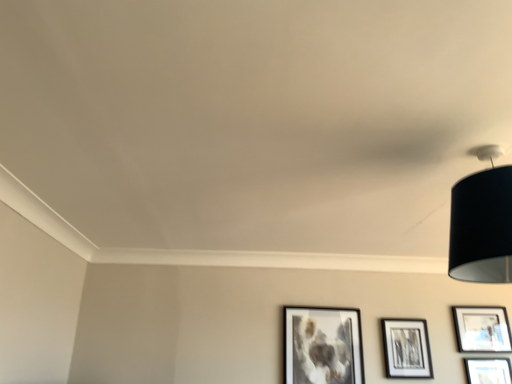
Question: Should I look upward or downward to see matte black picture frame at center right, placed as the 2th picture frame when sorted from left to right?

Choices:
 (A) down
 (B) up

Answer: (A)

Question: Is matte black picture frame at lower right, arranged as the fourth picture frame when viewed from the left, taller than matte black picture frame at lower center, placed as the fourth picture frame when sorted from right to left?

Choices:
 (A) yes
 (B) no

Answer: (B)

Question: From the image's perspective, is matte black picture frame at lower right, which is the 1th picture frame in right-to-left order, located beneath matte black picture frame at lower center, which is counted as the 1th picture frame, starting from the left?

Choices:
 (A) yes
 (B) no

Answer: (B)

Question: Does matte black picture frame at lower right, arranged as the fourth picture frame when viewed from the left, appear on the left side of matte black picture frame at lower center, placed as the fourth picture frame when sorted from right to left?

Choices:
 (A) no
 (B) yes

Answer: (A)

Question: Considering the relative sizes of matte black picture frame at lower right, which is the 1th picture frame in right-to-left order, and matte black picture frame at lower center, which is counted as the 1th picture frame, starting from the left, in the image provided, is matte black picture frame at lower right, which is the 1th picture frame in right-to-left order, wider than matte black picture frame at lower center, which is counted as the 1th picture frame, starting from the left,?

Choices:
 (A) no
 (B) yes

Answer: (B)

Question: From the image's perspective, would you say matte black picture frame at lower right, arranged as the fourth picture frame when viewed from the left, is positioned over matte black picture frame at lower center, placed as the fourth picture frame when sorted from right to left?

Choices:
 (A) yes
 (B) no

Answer: (A)

Question: Could you tell me if matte black picture frame at lower right, which is the 1th picture frame in right-to-left order, is turned towards matte black picture frame at lower center, placed as the fourth picture frame when sorted from right to left?

Choices:
 (A) yes
 (B) no

Answer: (B)

Question: Is matte black picture frame at center right, which is the 3th picture frame in right-to-left order, facing towards black fabric lampshade at upper right?

Choices:
 (A) yes
 (B) no

Answer: (A)

Question: Is black fabric lampshade at upper right inside matte black picture frame at center right, placed as the 2th picture frame when sorted from left to right?

Choices:
 (A) no
 (B) yes

Answer: (A)

Question: Is matte black picture frame at center right, placed as the 2th picture frame when sorted from left to right, next to black fabric lampshade at upper right?

Choices:
 (A) no
 (B) yes

Answer: (A)

Question: Is matte black picture frame at center right, which is the 3th picture frame in right-to-left order, bigger than black fabric lampshade at upper right?

Choices:
 (A) no
 (B) yes

Answer: (A)

Question: Considering the relative sizes of matte black picture frame at center right, which is the 3th picture frame in right-to-left order, and black fabric lampshade at upper right in the image provided, is matte black picture frame at center right, which is the 3th picture frame in right-to-left order, shorter than black fabric lampshade at upper right?

Choices:
 (A) no
 (B) yes

Answer: (B)

Question: Is matte black picture frame at center right, placed as the 2th picture frame when sorted from left to right, thinner than black fabric lampshade at upper right?

Choices:
 (A) yes
 (B) no

Answer: (A)

Question: From a real-world perspective, is matte black picture frame at lower right, the third picture frame viewed from the left, beneath matte black picture frame at lower right, arranged as the fourth picture frame when viewed from the left?

Choices:
 (A) yes
 (B) no

Answer: (A)